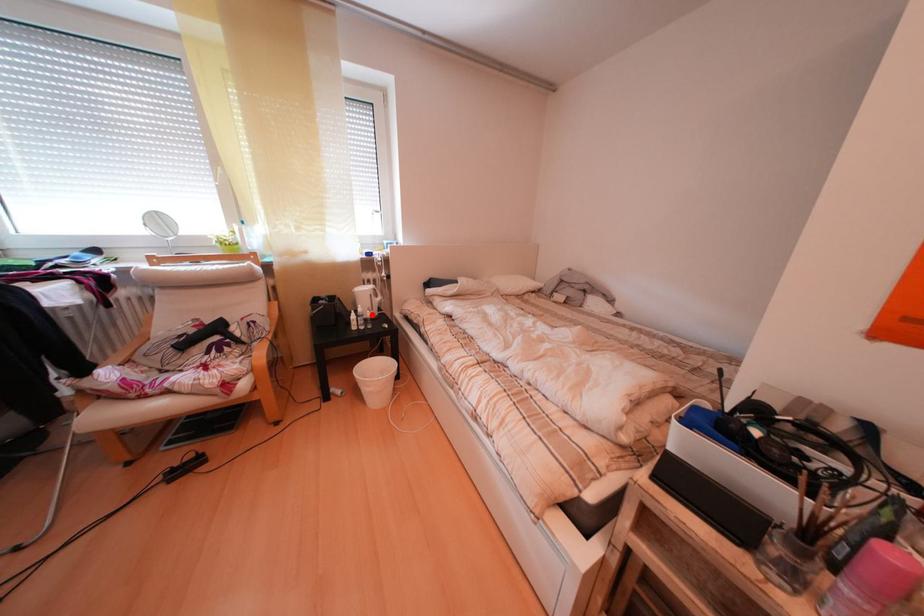
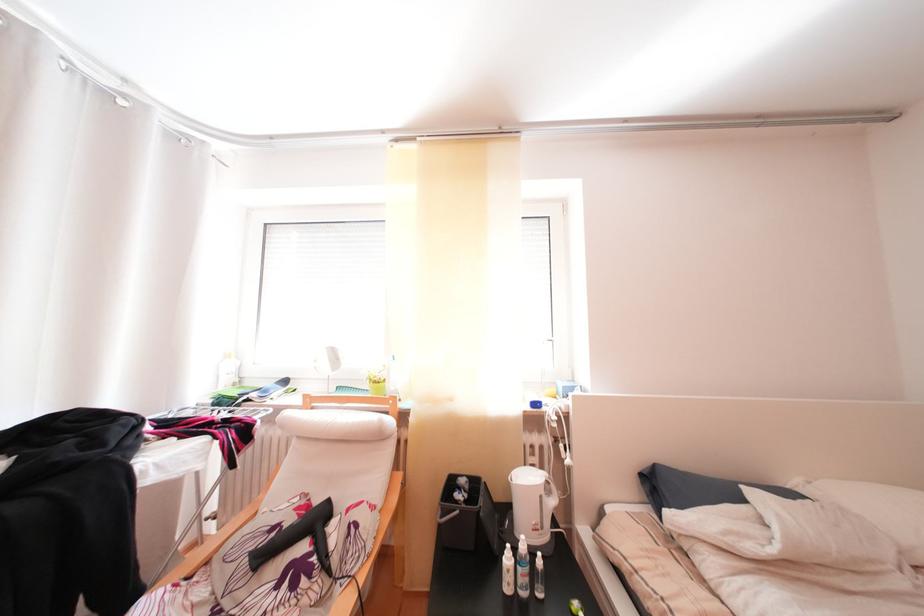
Question: I am providing you with two images of the same scene from different viewpoints. In image1, a red point is highlighted. Considering the same 3D point in image2, which of the following is correct?

Choices:
 (A) It is closer
 (B) It is farther

Answer: (B)